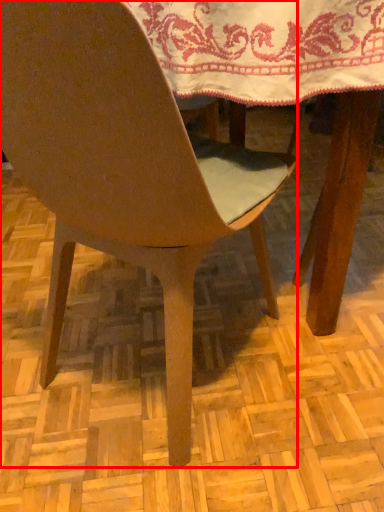
Question: From the image, what is the correct spatial relationship of chair (annotated by the red box) in relation to tablecloth?

Choices:
 (A) right
 (B) left

Answer: (B)